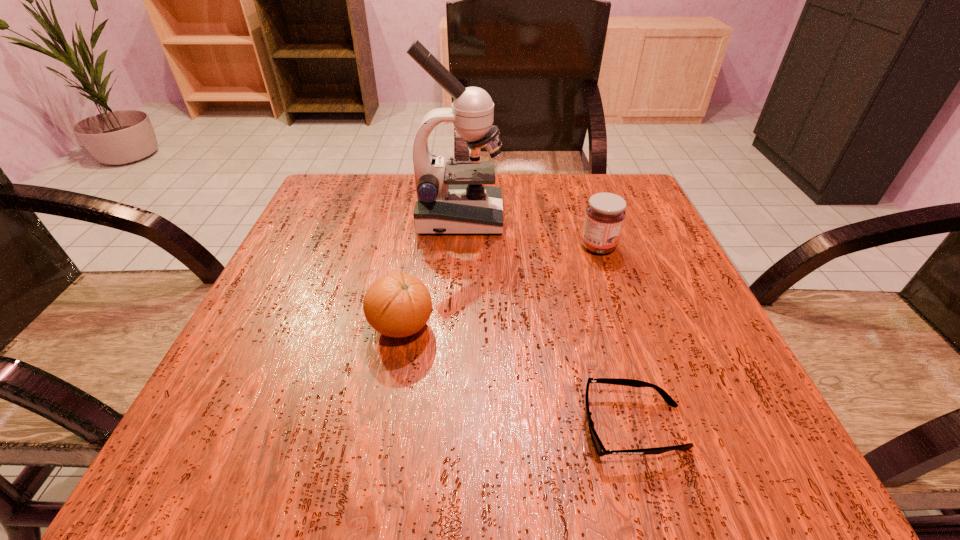
I want to click on microscope, so pyautogui.click(x=454, y=198).

The width and height of the screenshot is (960, 540). Find the location of `jam`. jam is located at coordinates (605, 213).

What are the coordinates of `orange` in the screenshot? It's located at (397, 305).

Locate an element on the screen. the shortest object is located at coordinates (600, 449).

Where is `the nearest object`? This screenshot has height=540, width=960. the nearest object is located at coordinates (600, 449).

Find the location of a particular element. free space located 0.210m on the front of the tallest object is located at coordinates (454, 309).

Find the location of `free space located on the right of the jam`. free space located on the right of the jam is located at coordinates (671, 246).

Locate an element on the screen. The width and height of the screenshot is (960, 540). vacant region located on the left of the second nearest object is located at coordinates (339, 327).

This screenshot has height=540, width=960. Identify the location of free region located on the front-facing side of the nearest object. click(x=524, y=427).

Where is `blank space located 0.370m on the front-facing side of the nearest object`? Image resolution: width=960 pixels, height=540 pixels. blank space located 0.370m on the front-facing side of the nearest object is located at coordinates (308, 427).